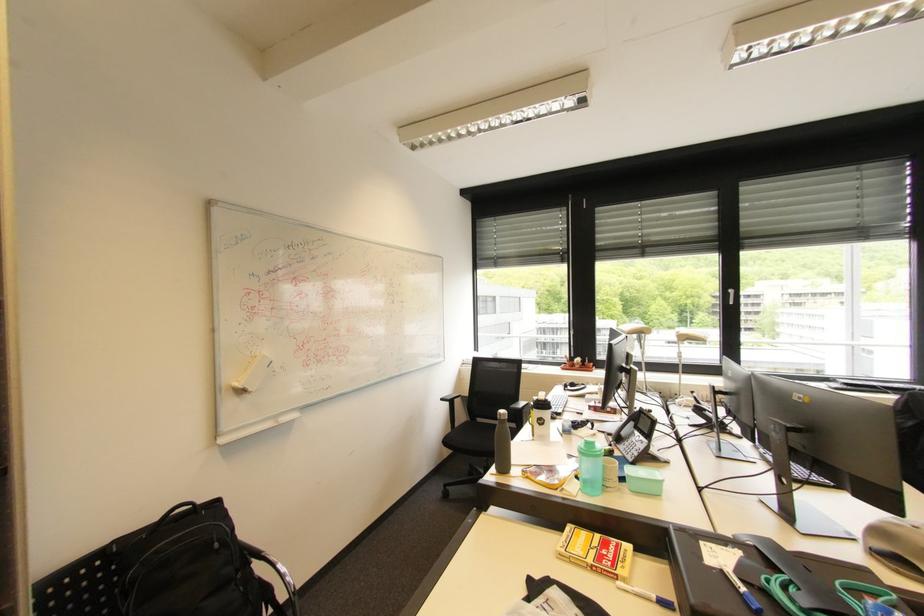
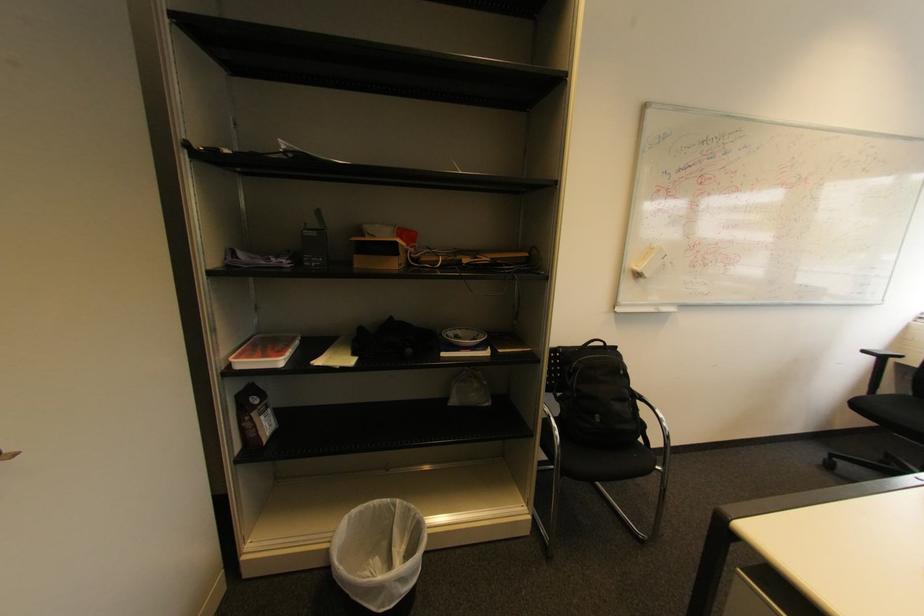
Locate, in the second image, the point that corresponds to pixel 205 505 in the first image.

(613, 345)